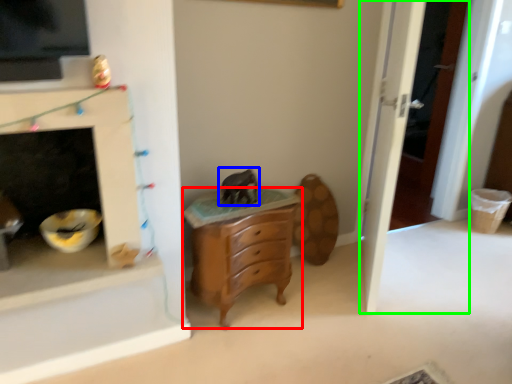
Question: Based on their relative distances, which object is farther from chest of drawers (highlighted by a red box)? Choose from animal (highlighted by a blue box) and door (highlighted by a green box).

Choices:
 (A) animal
 (B) door

Answer: (B)